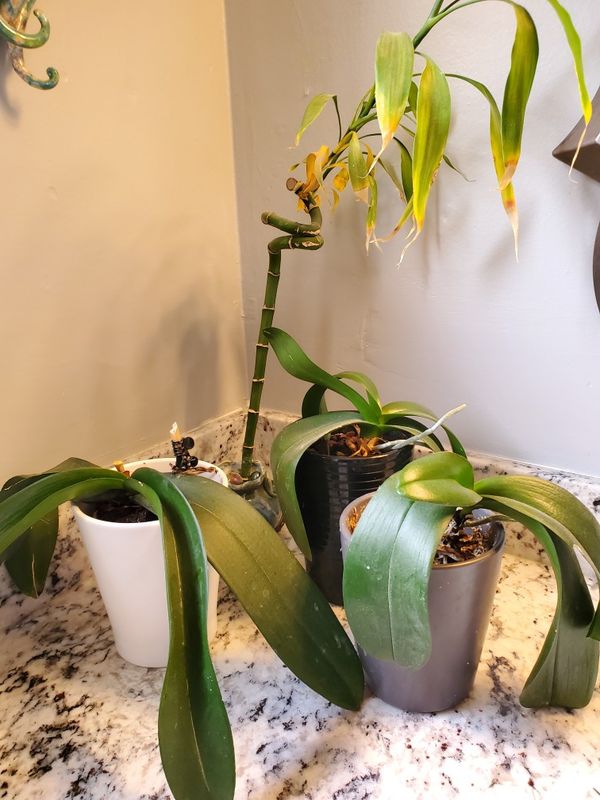
Find the location of a particular element. The image size is (600, 800). wall hooks is located at coordinates (37, 40), (28, 76).